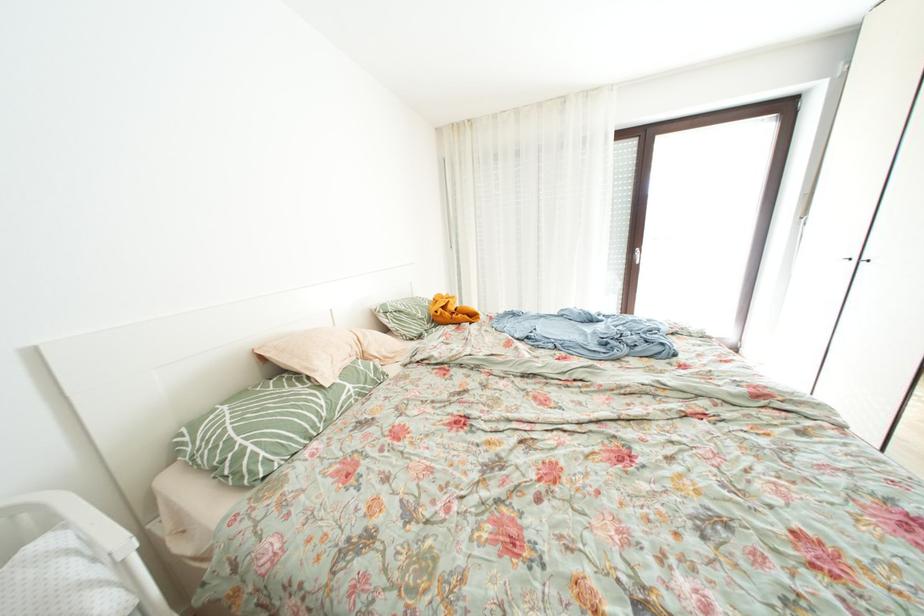
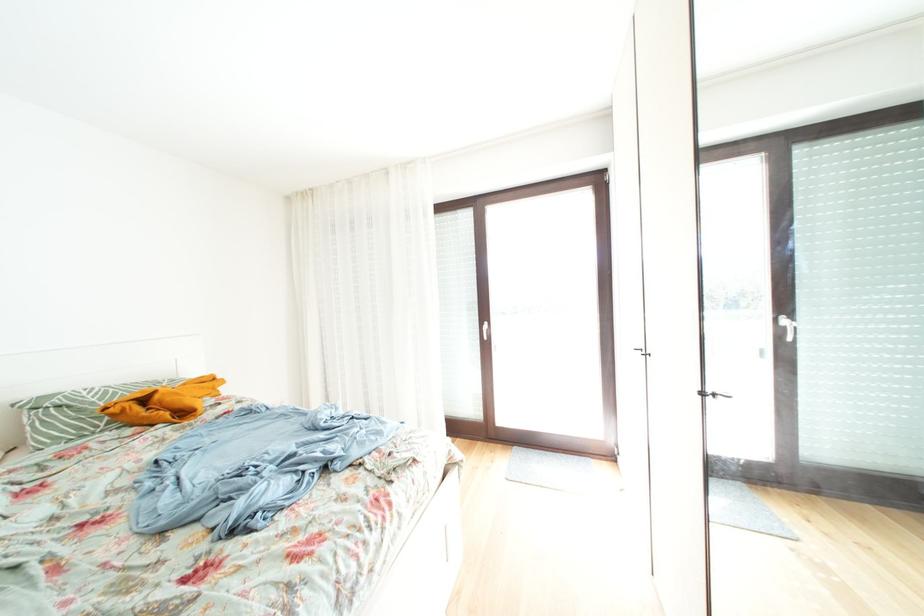
Question: The images are taken continuously from a first-person perspective. In which direction are you moving?

Choices:
 (A) Left
 (B) Right
 (C) Forward
 (D) Backward

Answer: (B)